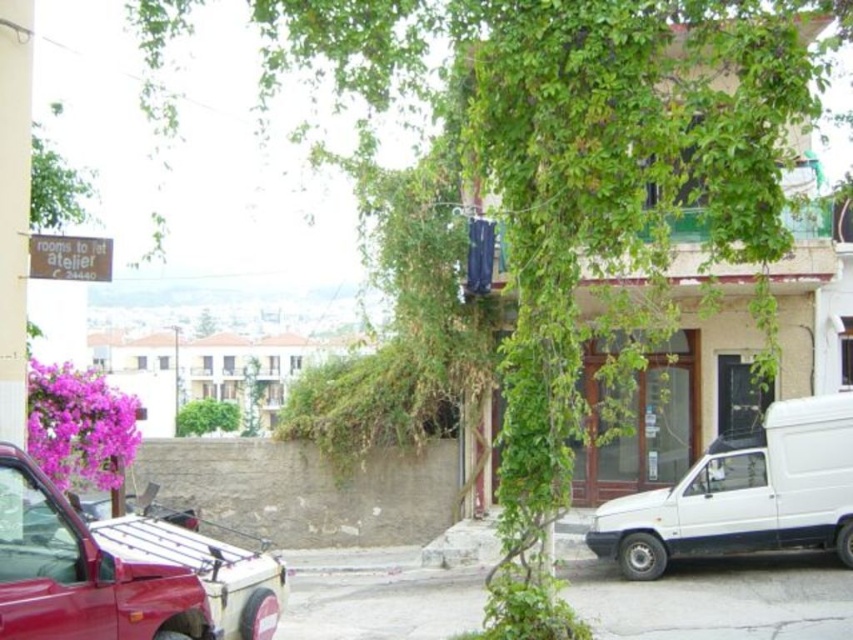
Which is in front, point (4, 502) or point (692, 500)?

Point (4, 502)

Is metallic red car at lower left to the right of white matte van at lower right from the viewer's perspective?

In fact, metallic red car at lower left is to the left of white matte van at lower right.

Locate an element on the screen. The height and width of the screenshot is (640, 853). metallic red car at lower left is located at coordinates (103, 572).